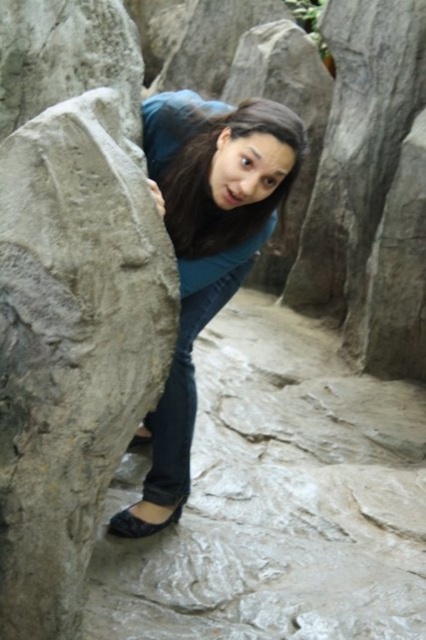
Which is behind, point (164, 476) or point (138, 522)?

Point (164, 476)

At what (x,y) coordinates should I click in order to perform the action: click on blue matte shirt at center. Please return your answer as a coordinate pair (x, y). This screenshot has height=640, width=426. Looking at the image, I should click on (207, 241).

Between blue matte shirt at center and brown matte hair at center, which one is positioned higher?

brown matte hair at center is higher up.

The height and width of the screenshot is (640, 426). What are the coordinates of `blue matte shirt at center` in the screenshot? It's located at (207, 241).

Where is `blue matte shirt at center`? blue matte shirt at center is located at coordinates (207, 241).

What do you see at coordinates (212, 186) in the screenshot? I see `brown matte hair at center` at bounding box center [212, 186].

Does brown matte hair at center appear over black leather sandal at lower left?

Yes.

The width and height of the screenshot is (426, 640). Find the location of `brown matte hair at center`. brown matte hair at center is located at coordinates (212, 186).